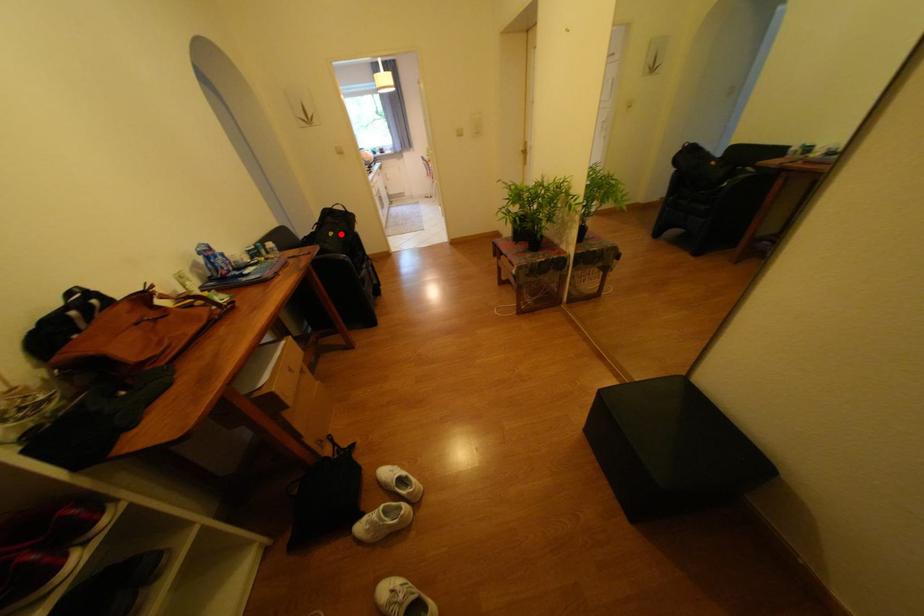
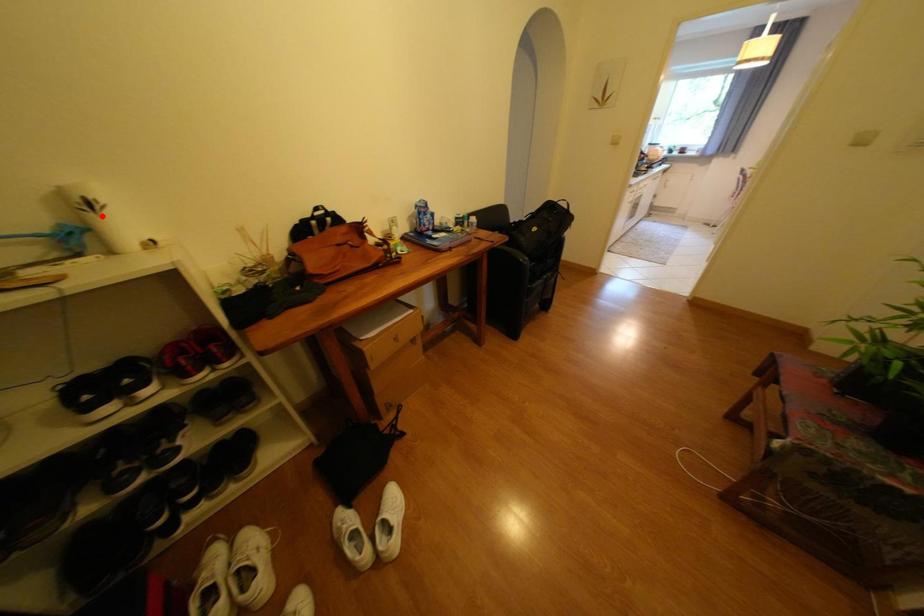
I am providing you with two images of the same scene from different viewpoints. A red point is marked on the first image and another point is marked on the second image. Are the points marked in image1 and image2 representing the same 3D position?

No